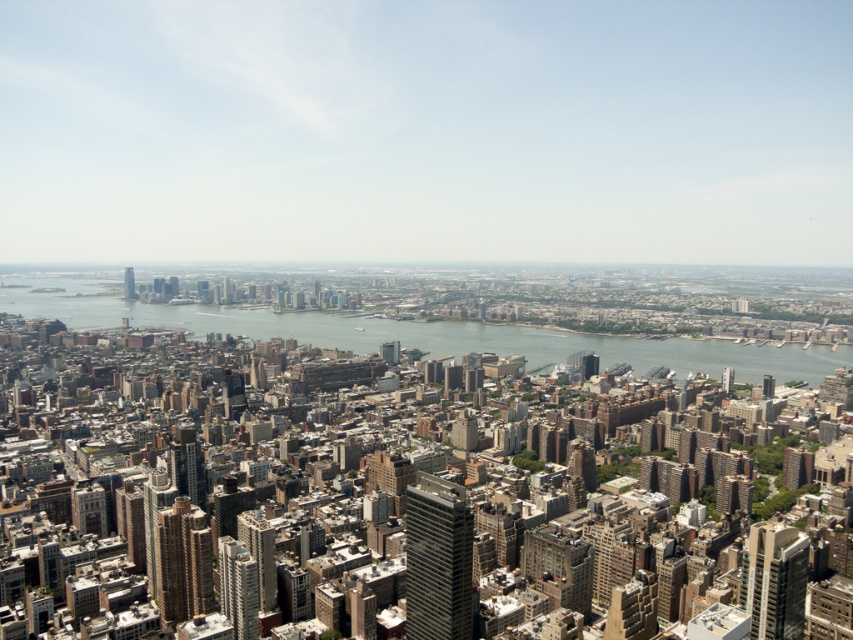
You are a drone operator tasked with flying a drone between the clear blue water at center and the metallic glass skyscraper at center. The drone has a maximum flight distance of 200 meters. Can the drone safely complete this flight without exceeding its range limit?

The clear blue water at center and metallic glass skyscraper at center are 229.57 meters apart from each other. Since the drone has a maximum flight distance of 200 meters, it cannot safely complete the flight without exceeding its range limit.

You are a drone operator who needs to deliver a package to a building located at the coordinates point (425, 333). However, you notice that the area around this point is covered with clear blue water at center. Can you safely land the drone there?

The point (425, 333) indicates clear blue water at center, so the drone cannot land there as it is over water.